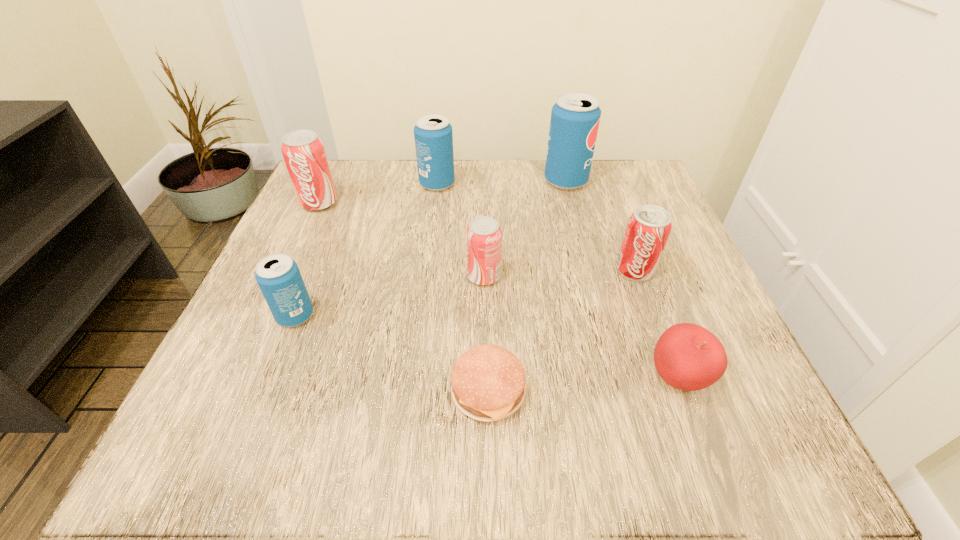
Identify the location of unoccupied area between the nearest soda can and the farthest red soda can. The width and height of the screenshot is (960, 540). (307, 260).

This screenshot has width=960, height=540. What are the coordinates of `free space between the tallest object and the rightmost red soda can` in the screenshot? It's located at (600, 226).

Where is `vacant region between the smallest blue soda can and the tallest object`? vacant region between the smallest blue soda can and the tallest object is located at coordinates (431, 248).

Identify the location of free spot between the fourth soda can from left to right and the shortest object. (486, 334).

Where is `free spot between the biggest red soda can and the second biggest blue soda can`? The width and height of the screenshot is (960, 540). free spot between the biggest red soda can and the second biggest blue soda can is located at coordinates (378, 194).

This screenshot has width=960, height=540. I want to click on vacant area that lies between the smallest blue soda can and the hamburger, so click(392, 354).

Choose which object is the sixth nearest neighbor to the rightmost red soda can. Please provide its 2D coordinates. Your answer should be formatted as a tuple, i.e. [(x, y)], where the tuple contains the x and y coordinates of a point satisfying the conditions above.

[(279, 279)]

This screenshot has width=960, height=540. Identify the location of object that ranks as the fifth closest to the second red soda can from left to right. (279, 279).

Identify the location of soda can that stands as the fifth closest to the third soda can from right to left. The image size is (960, 540). (303, 151).

Select which soda can appears as the closest to the biggest red soda can. Please provide its 2D coordinates. Your answer should be formatted as a tuple, i.e. [(x, y)], where the tuple contains the x and y coordinates of a point satisfying the conditions above.

[(433, 135)]